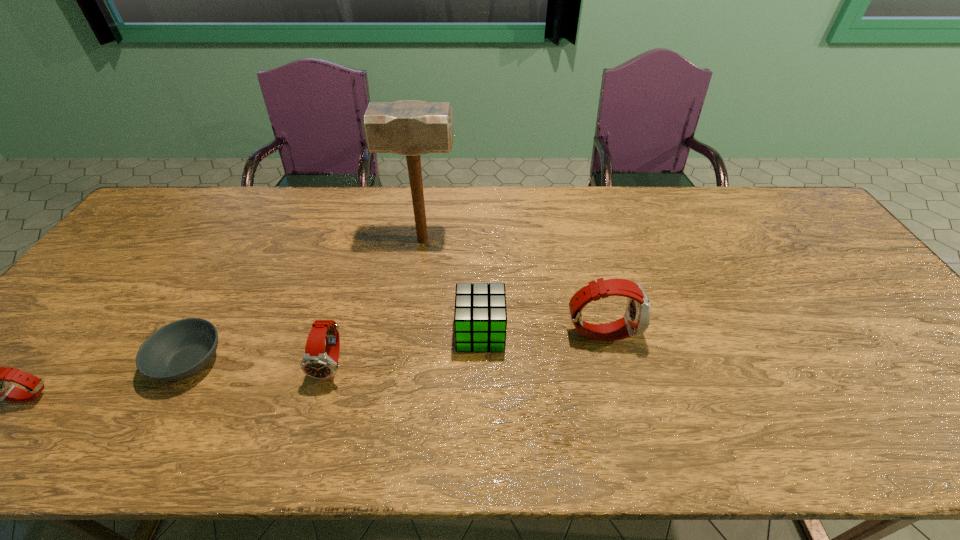
At what (x,y) coordinates should I click in order to perform the action: click on vacant region located on the striking face of the mallet. Please return your answer as a coordinate pair (x, y). Looking at the image, I should click on (570, 240).

You are a GUI agent. You are given a task and a screenshot of the screen. Output one action in this format:
    pyautogui.click(x=<x>, y=<y>)
    Task: Click on the vacant point located on the right of the shortest object
    This screenshot has height=540, width=960.
    Given the screenshot: What is the action you would take?
    pyautogui.click(x=351, y=362)

In order to click on vacant region located 0.340m on the right of the fifth object from left to right in this screenshot , I will do [639, 333].

This screenshot has width=960, height=540. Find the location of `object at the far edge`. object at the far edge is located at coordinates (411, 128).

Image resolution: width=960 pixels, height=540 pixels. I want to click on watch that is at the near edge, so click(x=317, y=363).

In order to click on soup bowl at the near edge in this screenshot , I will do `click(181, 349)`.

In the image, there is a desktop. At what (x,y) coordinates should I click in order to perform the action: click on free region at the far edge. Please return your answer as a coordinate pair (x, y). Looking at the image, I should click on (450, 225).

At what (x,y) coordinates should I click in order to perform the action: click on blank space at the near edge of the desktop. Please return your answer as a coordinate pair (x, y). Looking at the image, I should click on (177, 399).

Identify the location of vacant area at the left edge. This screenshot has height=540, width=960. (131, 298).

In order to click on vacant space at the far left corner of the desktop in this screenshot , I will do `click(174, 227)`.